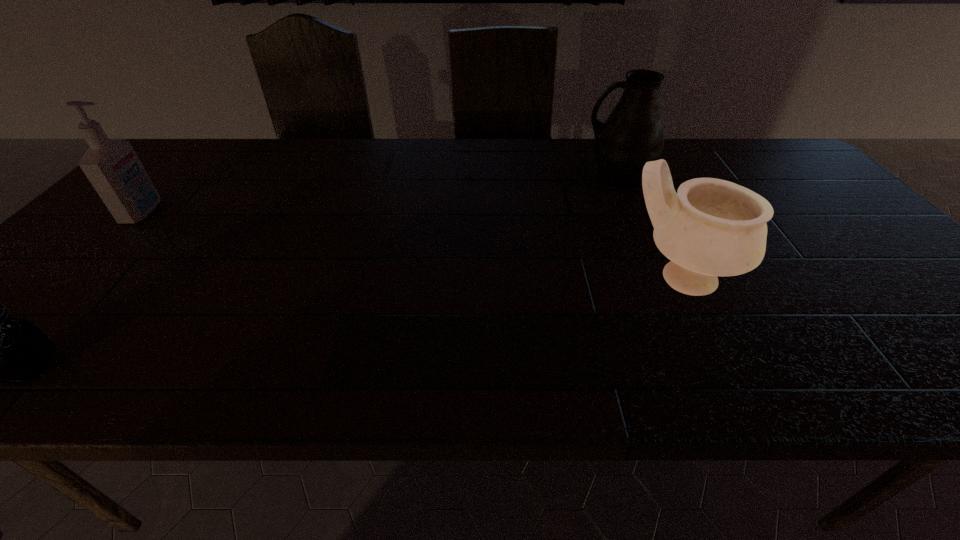
The image size is (960, 540). Identify the location of vacant region between the pottery and the cleansing agent. (412, 245).

Find the location of a particular element. The image size is (960, 540). the closest object to the nearest object is located at coordinates (113, 168).

Find the location of `the third closest object relative to the second farthest object`. the third closest object relative to the second farthest object is located at coordinates (711, 227).

You are a GUI agent. You are given a task and a screenshot of the screen. Output one action in this format:
    pyautogui.click(x=<x>, y=<y>)
    Task: Click on the free point that satisfies the following two spatial constraints: 1. on the front label of the third tallest object; 2. on the left side of the cleansing agent
    
    Given the screenshot: What is the action you would take?
    pyautogui.click(x=81, y=278)

I want to click on vacant space that satisfies the following two spatial constraints: 1. on the front label of the cleansing agent; 2. on the back side of the third farthest object, so click(81, 278).